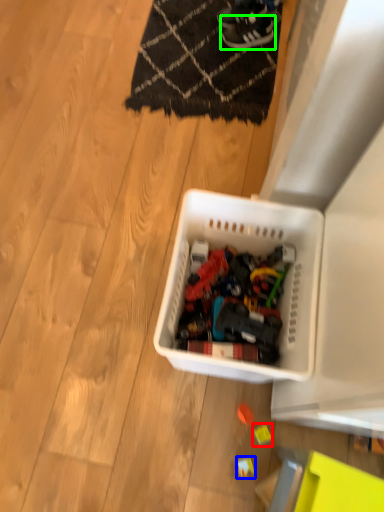
Question: Which object is positioned farthest from toy (highlighted by a red box)? Select from toy (highlighted by a blue box) and footwear (highlighted by a green box).

Choices:
 (A) toy
 (B) footwear

Answer: (B)